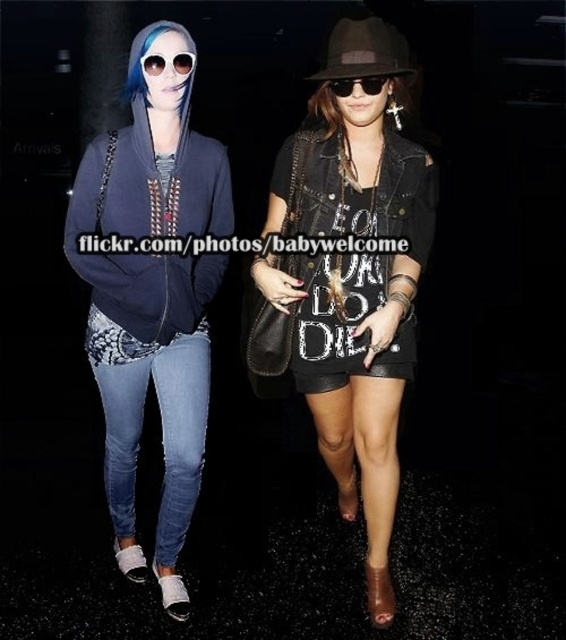
You are a security camera monitoring the area. You notice two people walking side by side. Based on the image, which object is taller between the matte blue hoodie at left and the blue denim jeans at lower left?

The matte blue hoodie at left is much taller than the blue denim jeans at lower left according to the description.

You are a photographer taking a picture of the matte blue hoodie at left and the dark brown felt fedora at upper center. Which object will appear larger in the photo?

The matte blue hoodie at left will appear larger in the photo because it is closer to the camera than the dark brown felt fedora at upper center.

You are standing in front of the two people in the image. Which of the two points, point [165,230] or point [173,468], is closer to you?

Point [165,230] is closer to you than point [173,468].